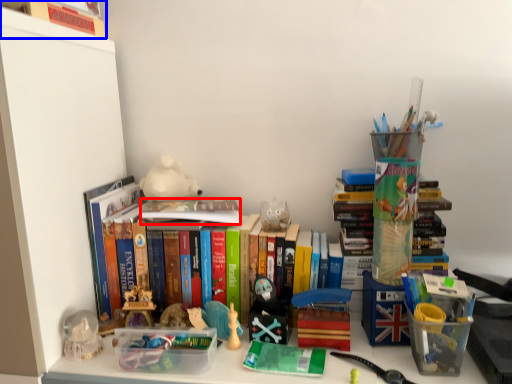
Question: Which object appears closest to the camera in this image, book (highlighted by a red box) or book (highlighted by a blue box)?

Choices:
 (A) book
 (B) book

Answer: (B)